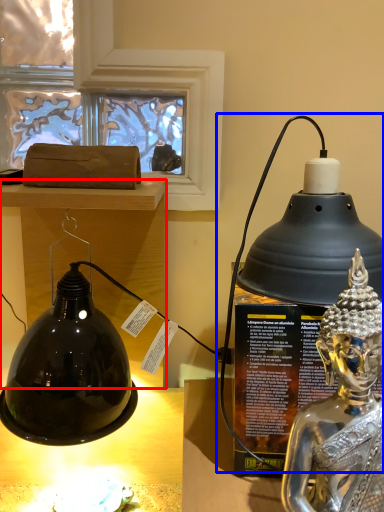
Question: Among these objects, which one is nearest to the camera, furniture (highlighted by a red box) or oil lamp (highlighted by a blue box)?

Choices:
 (A) furniture
 (B) oil lamp

Answer: (B)